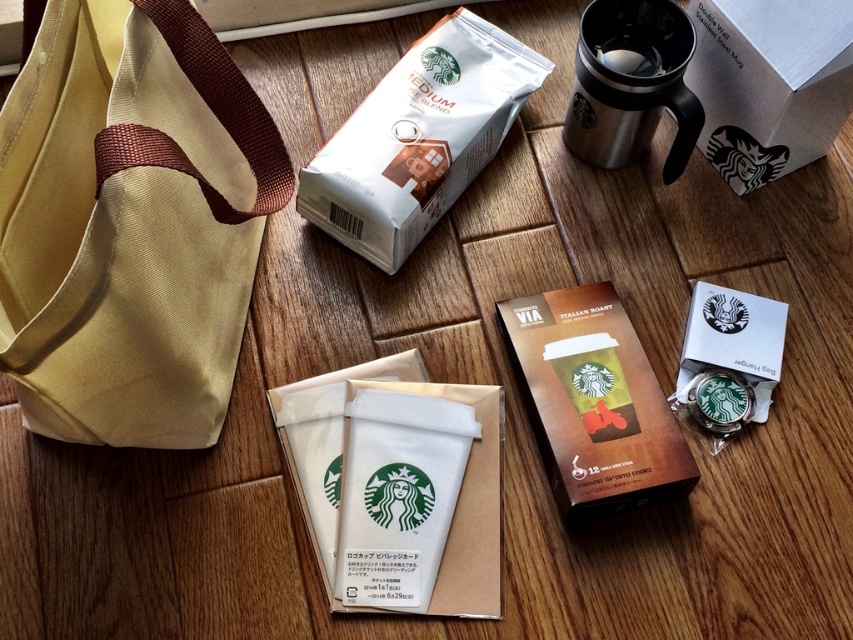
Question: Is white paper cup at center closer to the viewer compared to white matte bag at center?

Choices:
 (A) no
 (B) yes

Answer: (B)

Question: Can you confirm if white paper cup at center is bigger than white matte bag at center?

Choices:
 (A) yes
 (B) no

Answer: (B)

Question: Which point is closer to the camera?

Choices:
 (A) white matte bag at center
 (B) stainless steel mug at upper right

Answer: (B)

Question: Which point appears farthest from the camera in this image?

Choices:
 (A) (665, 74)
 (B) (718, 3)
 (C) (642, 40)
 (D) (91, 300)

Answer: (C)

Question: Is white paper cup at center wider than brown cardboard box at center?

Choices:
 (A) yes
 (B) no

Answer: (A)

Question: Among these points, which one is nearest to the camera?

Choices:
 (A) (596, 45)
 (B) (352, 204)
 (C) (612, 90)

Answer: (B)